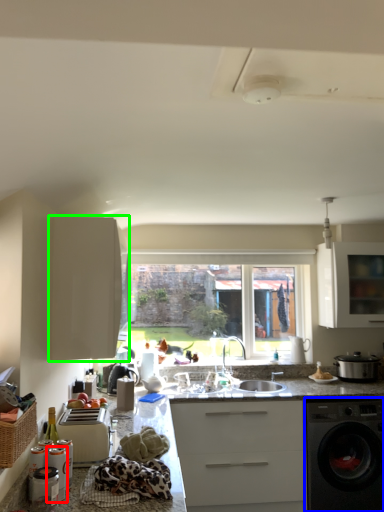
Question: Which is farther away from appliance (highlighted by a red box)? home appliance (highlighted by a blue box) or cabinetry (highlighted by a green box)?

Choices:
 (A) home appliance
 (B) cabinetry

Answer: (A)